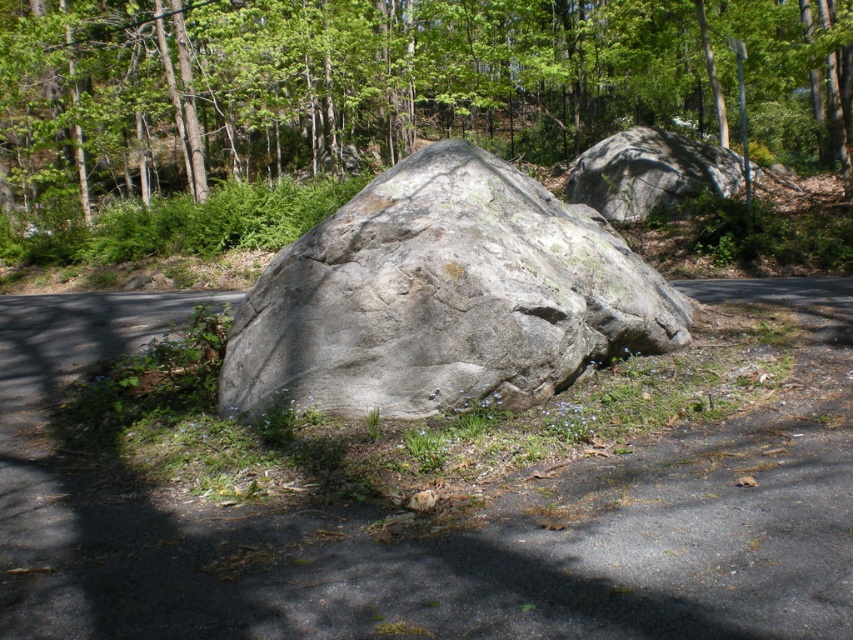
Question: Which of these objects is positioned farthest from the green leafy tree at center?

Choices:
 (A) gray rough boulder at upper right
 (B) gray rough rock at center

Answer: (B)

Question: Does gray rough rock at center have a smaller size compared to gray rough boulder at upper right?

Choices:
 (A) yes
 (B) no

Answer: (A)

Question: Which point is farther to the camera?

Choices:
 (A) green leafy tree at center
 (B) gray rough rock at center

Answer: (A)

Question: Does green leafy tree at center come behind gray rough boulder at upper right?

Choices:
 (A) no
 (B) yes

Answer: (A)

Question: From the image, what is the correct spatial relationship of green leafy tree at center in relation to gray rough rock at center?

Choices:
 (A) right
 (B) left

Answer: (B)

Question: Which of the following is the closest to the observer?

Choices:
 (A) (350, 136)
 (B) (662, 148)

Answer: (B)